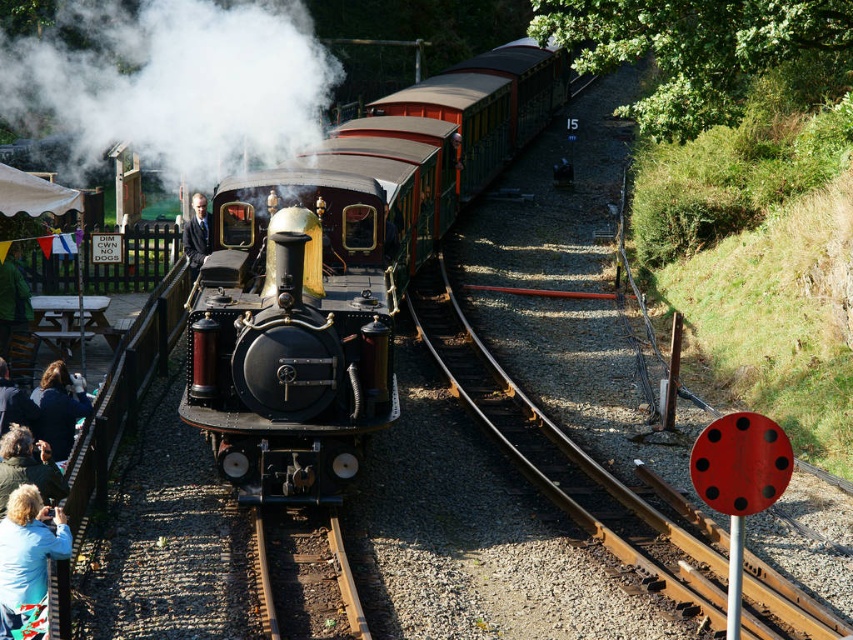
You are a railway engineer assessing the train setup. The polished brass steam engine at center and the white vapor at center are both visible. Which object is wider?

The white vapor at center is wider than the polished brass steam engine at center.

You are a photographer at the railway station and want to take a photo of the dark suit at center without the green fabric jacket at lower left blocking it. How should you adjust your position?

Move your position behind the dark suit at center so that it is between you and the green fabric jacket at lower left. Since the green fabric jacket at lower left is in front of the dark suit at center, moving behind the dark suit at center will place the dark suit at center between you and the jacket, thus avoiding the blockage.

You are a photographer standing at the railway station. You want to take a photo of the polished brass steam locomotive at center and the dark suit at center. Which object should you focus on first if you want to capture both in a single frame without moving the camera?

The polished brass steam locomotive at center is wider than the dark suit at center, so you should focus on the locomotive first to ensure it fits within the frame.